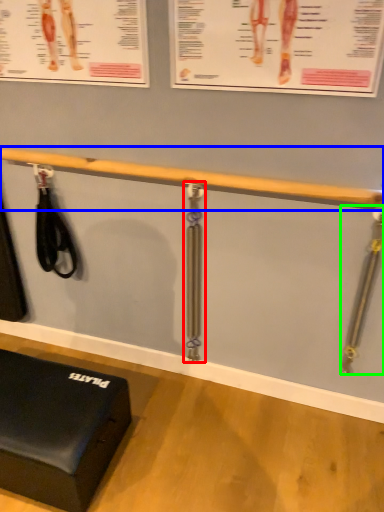
Question: Which object is positioned closest to tool (highlighted by a red box)? Select from beam (highlighted by a blue box) and tool (highlighted by a green box).

Choices:
 (A) beam
 (B) tool

Answer: (A)